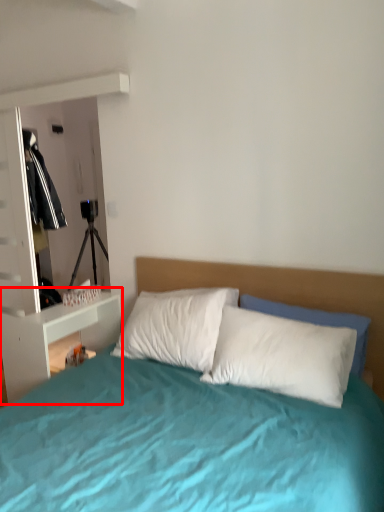
Question: Where is nightstand (annotated by the red box) located in relation to pillow in the image?

Choices:
 (A) left
 (B) right

Answer: (A)